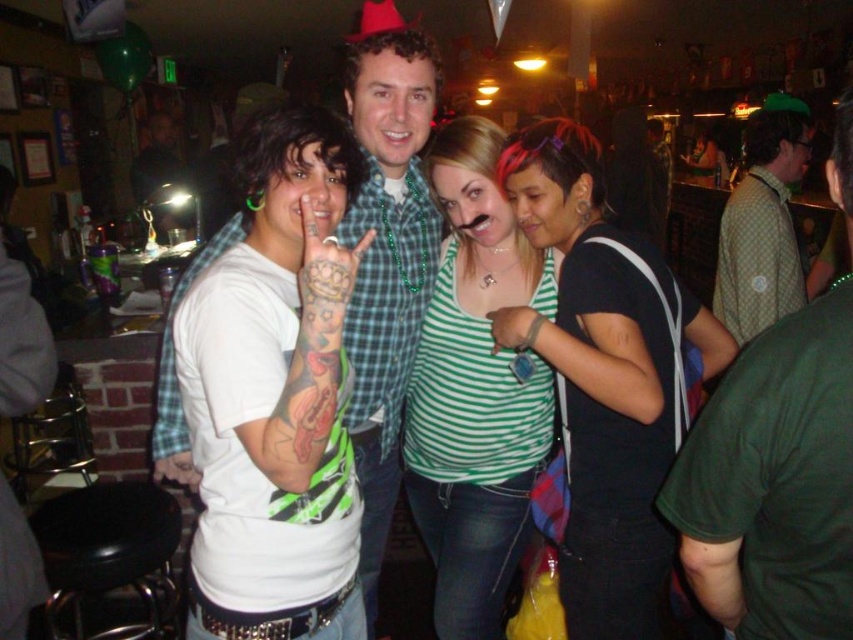
You are standing in the middle of the bar scene and want to take a photo of both the point at coordinates (508, 371) and the point at coordinates (381, 61). Since you can only focus on one point at a time, which point should you focus on first to ensure both are in the frame?

You should focus on the point at coordinates (381, 61) first because it is closer to the viewer than the point at coordinates (508, 371). By focusing on the closer point, the farther point will also be within the depth of field and in focus.